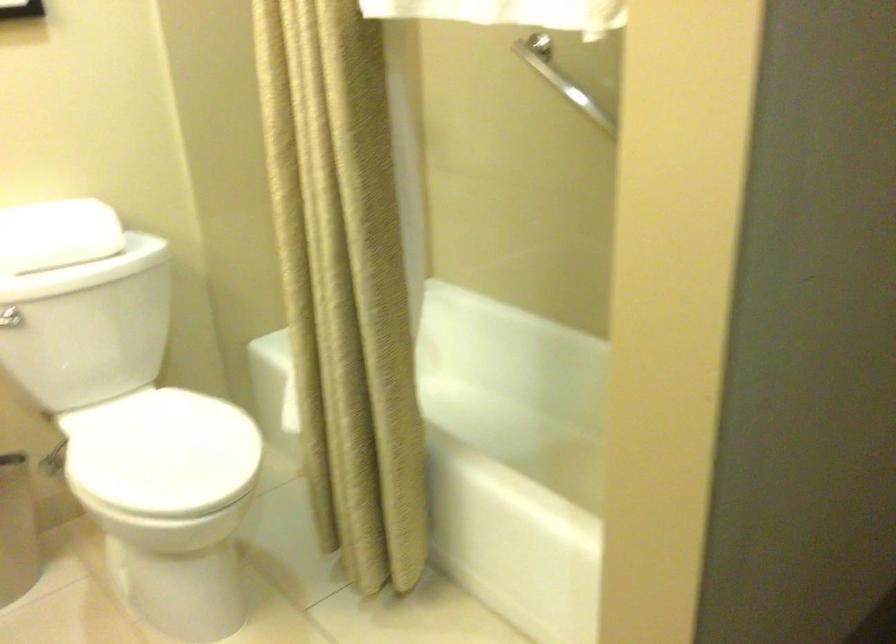
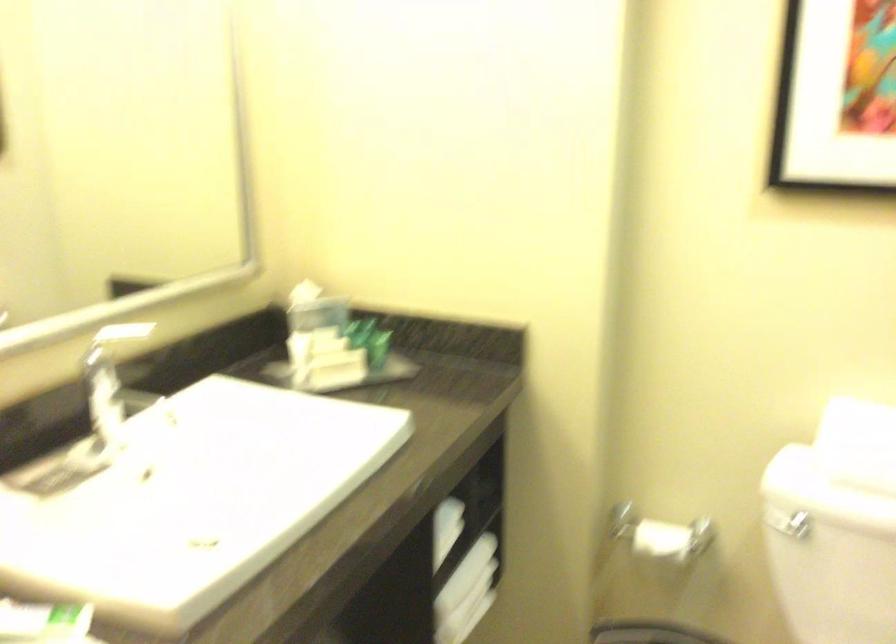
Question: Based on the continuous images, in which direction is the camera rotating? Reply with the corresponding letter.

Choices:
 (A) Left
 (B) Right
 (C) Up
 (D) Down

Answer: (A)